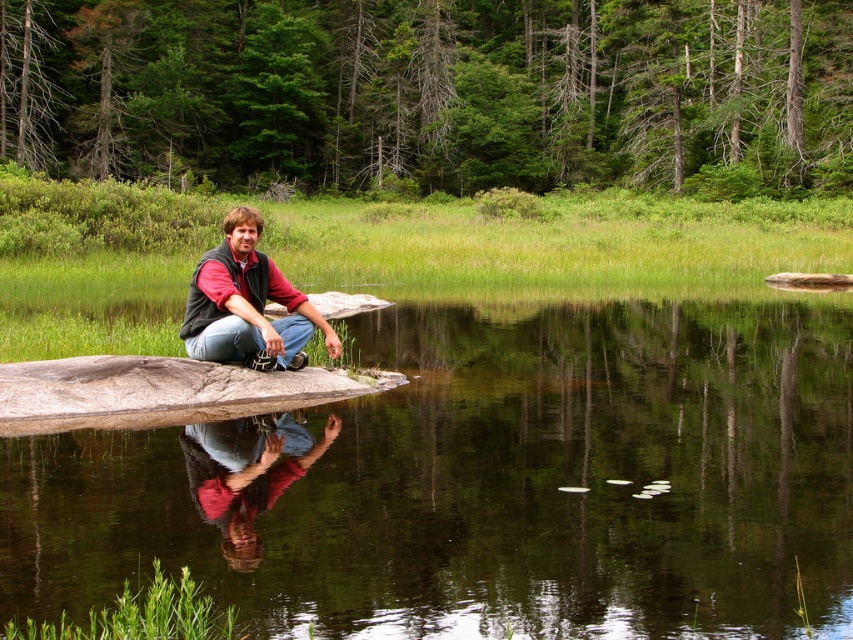
Which is more to the left, transparent water at center or matte black vest at center?

matte black vest at center is more to the left.

Between transparent water at center and matte black vest at center, which one is positioned higher?

matte black vest at center is above.

Find the location of `transparent water at center`. transparent water at center is located at coordinates (485, 483).

Identify the location of transparent water at center. (485, 483).